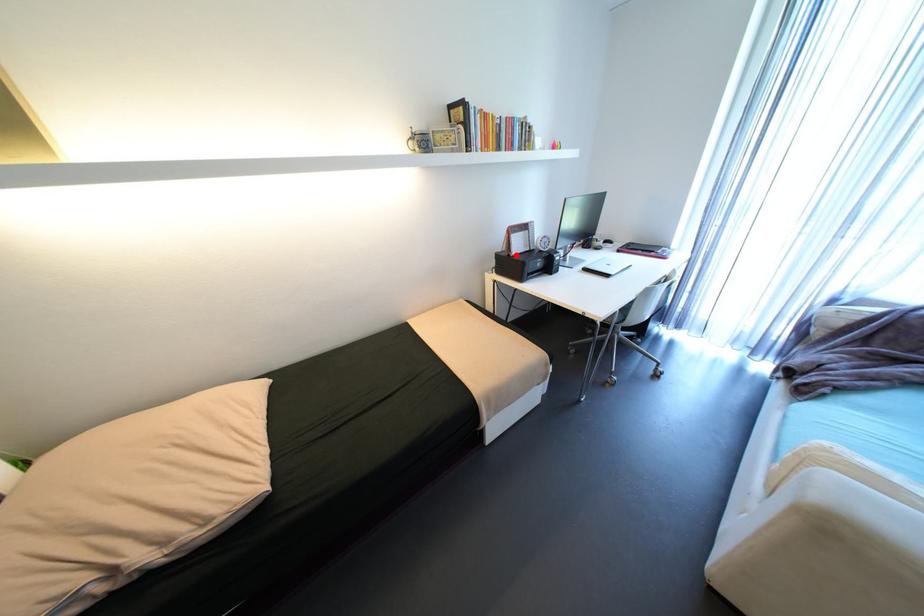
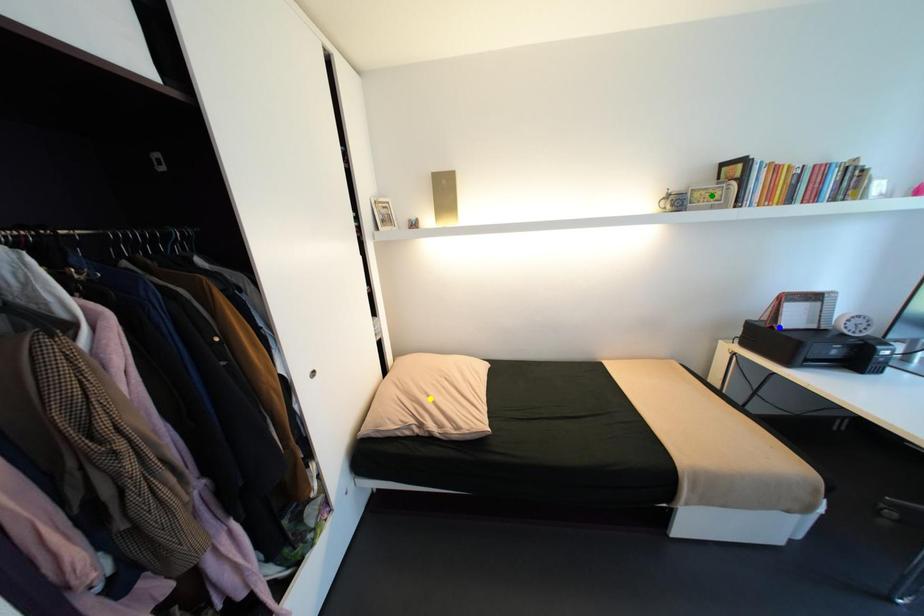
Question: I am providing you with two images of the same scene from different viewpoints. A red point is marked on the first image. You are given multiple points on the second image. Which spot in image 2 lines up with the point in image 1?

Choices:
 (A) green point
 (B) blue point
 (C) yellow point

Answer: (B)